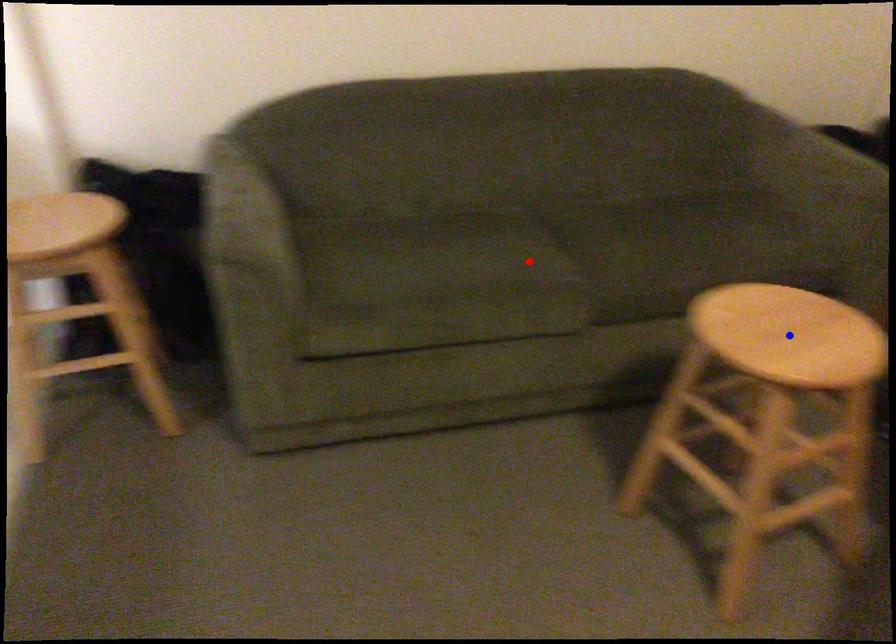
Question: Which of the two points in the image is closer to the camera?

Choices:
 (A) Blue point is closer.
 (B) Red point is closer.

Answer: (A)